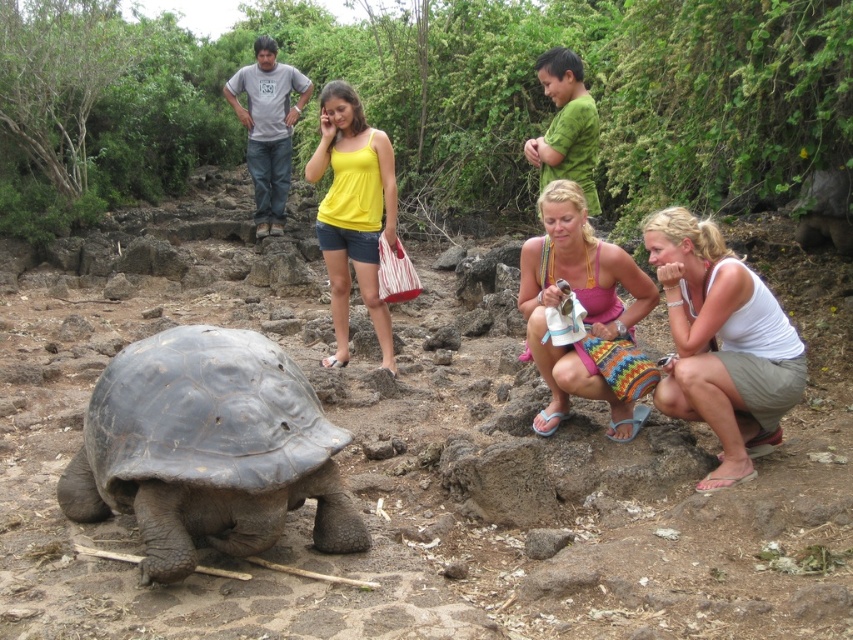
Question: Which point is closer to the camera?

Choices:
 (A) (531, 577)
 (B) (193, 332)
 (C) (646, 228)
 (D) (592, 259)

Answer: (A)

Question: Based on their relative distances, which object is farther from the yellow cotton tank top at center?

Choices:
 (A) white cotton tank top at lower right
 (B) dark gray textured tortoise at lower left

Answer: (B)

Question: Which object appears farthest from the camera in this image?

Choices:
 (A) yellow cotton tank top at center
 (B) white cotton tank top at lower right
 (C) pink knitted skirt at lower center
 (D) brown dirt ground at center

Answer: (D)

Question: Does dark gray textured tortoise at lower left have a smaller size compared to yellow cotton tank top at center?

Choices:
 (A) no
 (B) yes

Answer: (B)

Question: In this image, where is brown dirt ground at center located relative to yellow cotton tank top at center?

Choices:
 (A) below
 (B) above

Answer: (A)

Question: In this image, where is pink knitted skirt at lower center located relative to yellow cotton tank top at center?

Choices:
 (A) left
 (B) right

Answer: (B)